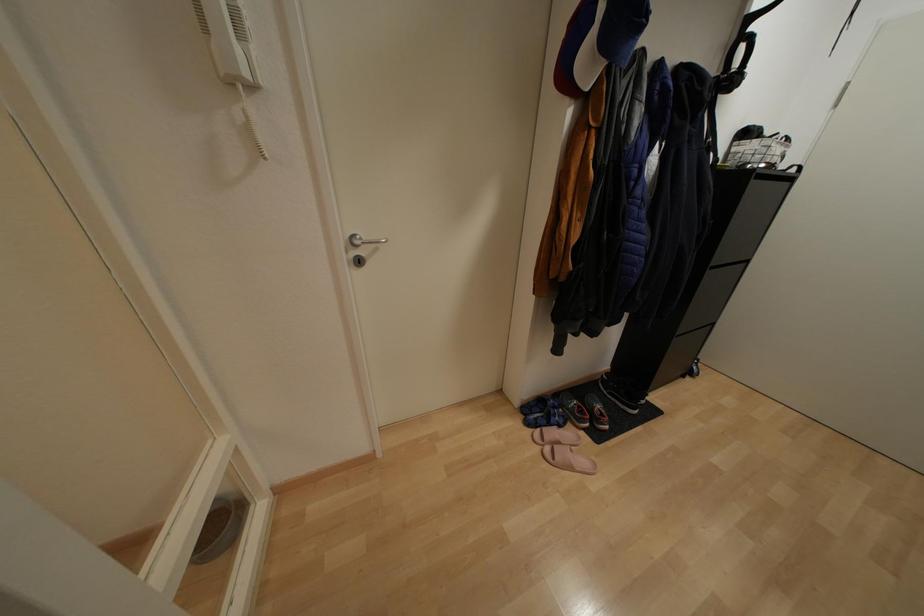
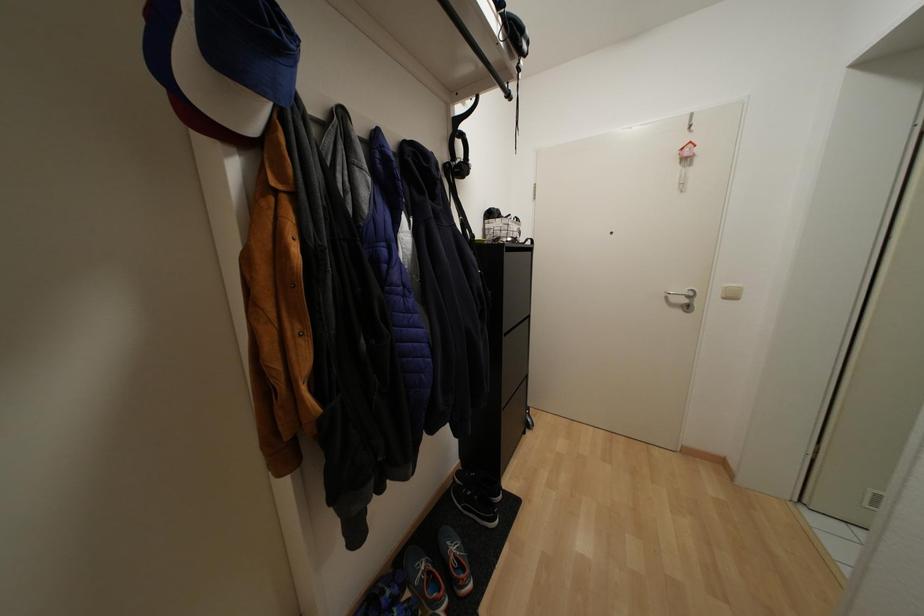
Question: The camera is either moving clockwise (left) or counter-clockwise (right) around the object. The first image is from the beginning of the video and the second image is from the end. Is the camera moving left or right when shooting the video?

Choices:
 (A) Left
 (B) Right

Answer: (A)